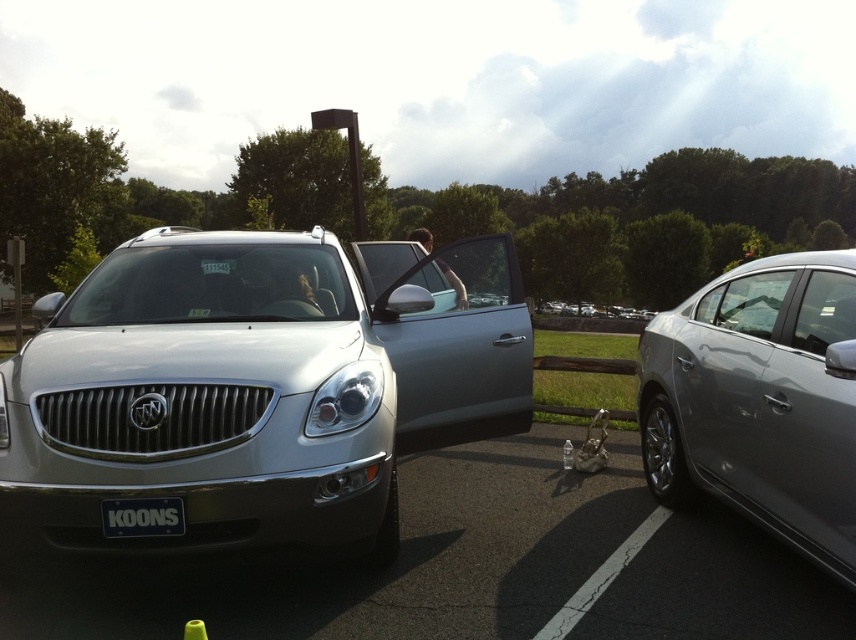
Does satin silver sedan at right have a smaller size compared to black matte license plate at center?

No.

Is satin silver sedan at right further to the viewer compared to black matte license plate at center?

No, satin silver sedan at right is closer to the viewer.

Between point (735, 406) and point (165, 500), which one is positioned in front?

Point (165, 500) is in front.

Identify the location of satin silver sedan at right. (759, 400).

Can you confirm if satin silver suv at center is positioned to the right of satin silver sedan at right?

In fact, satin silver suv at center is to the left of satin silver sedan at right.

Image resolution: width=856 pixels, height=640 pixels. Identify the location of satin silver suv at center. (254, 388).

Is satin silver suv at center behind black matte license plate at center?

That is True.

Which is above, satin silver suv at center or black matte license plate at center?

satin silver suv at center is higher up.

Between point (42, 442) and point (103, 518), which one is positioned in front?

Positioned in front is point (103, 518).

Identify the location of satin silver suv at center. The width and height of the screenshot is (856, 640). (254, 388).